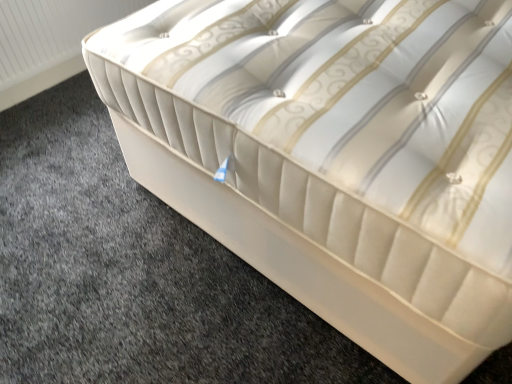
I want to click on free space in front of white glossy radiator at upper left, so click(62, 144).